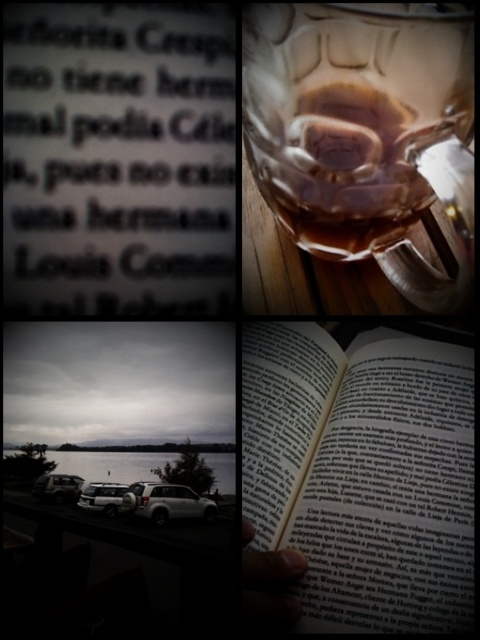
Does silver metallic suv at lower left appear on the right side of white matte car at lower left?

Yes, silver metallic suv at lower left is to the right of white matte car at lower left.

Does silver metallic suv at lower left have a larger size compared to white matte car at lower left?

Yes, silver metallic suv at lower left is bigger than white matte car at lower left.

Which is in front, point (159, 500) or point (100, 506)?

Point (100, 506)

Where is `silver metallic suv at lower left`? silver metallic suv at lower left is located at coordinates (167, 502).

Which is behind, point (411, 467) or point (146, 518)?

Positioned behind is point (411, 467).

Does white paper book at center have a greater height compared to silver metallic suv at lower left?

Yes.

Which is behind, point (471, 589) or point (194, 512)?

Point (194, 512)

At what (x,y) coordinates should I click in order to perform the action: click on white paper book at center. Please return your answer as a coordinate pair (x, y). Looking at the image, I should click on (362, 474).

Can you confirm if clear textured glass at upper right is smaller than silver metallic suv at lower left?

No, clear textured glass at upper right is not smaller than silver metallic suv at lower left.

Which is below, clear textured glass at upper right or silver metallic suv at lower left?

silver metallic suv at lower left is lower down.

Where is `clear textured glass at upper right`? The height and width of the screenshot is (640, 480). clear textured glass at upper right is located at coordinates (365, 134).